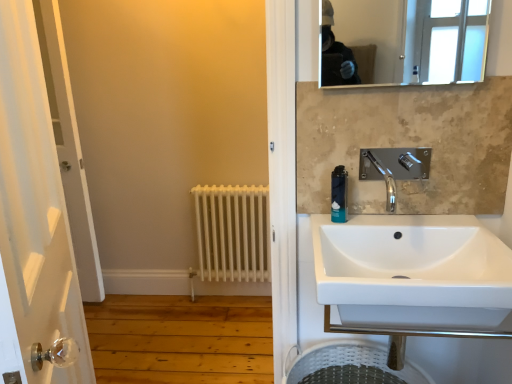
I want to click on free region on the left part of white matte radiator at lower left, so click(177, 319).